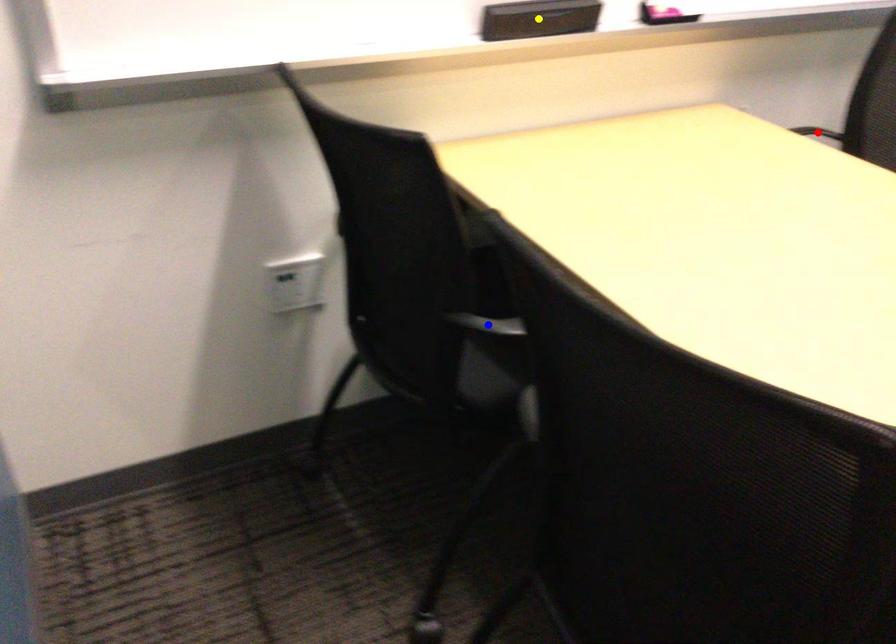
Order these from nearest to farthest:
- blue point
- yellow point
- red point

blue point, yellow point, red point